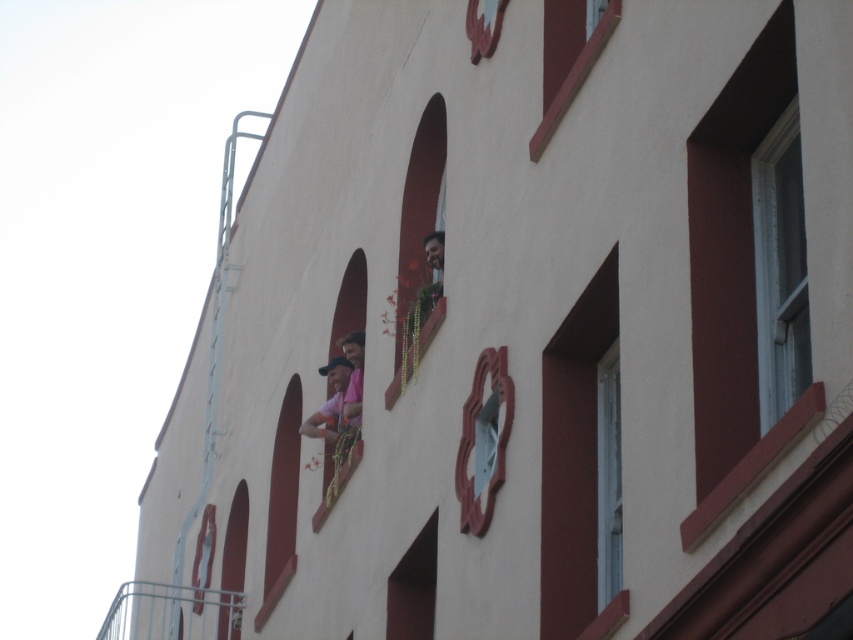
You are standing in front of the building and want to locate the smooth red window at center and the smooth red wood window at upper right. Which one is positioned to the right side of the other?

The smooth red wood window at upper right is positioned to the right of the smooth red window at center.

You are standing in front of the building and want to see both the smooth red window at center and the smooth red wood window at upper right. Which window is closer to you?

The smooth red window at center is closer to you because the smooth red wood window at upper right is behind it.

You are standing at the entrance of the building and want to hang a 10 feet wide banner between the clear glass window at upper right and the smooth red wood window at upper right. Is there enough space between them to fit the banner?

The clear glass window at upper right is 25.62 feet from the smooth red wood window at upper right, so yes, the banner can be hung between them since the distance is greater than the banner width.